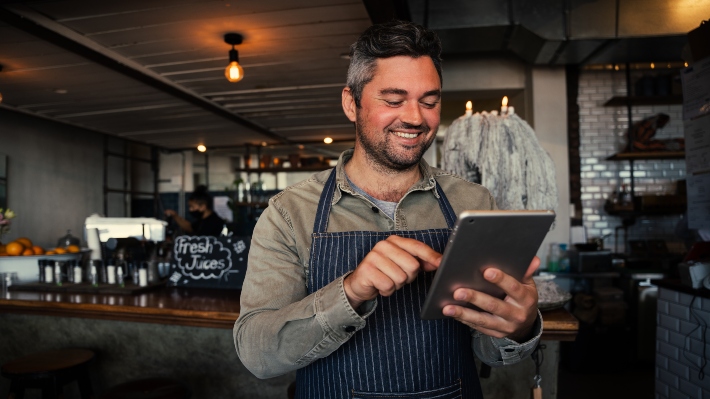
Where is `roof beam`? roof beam is located at coordinates (89, 53), (253, 130).